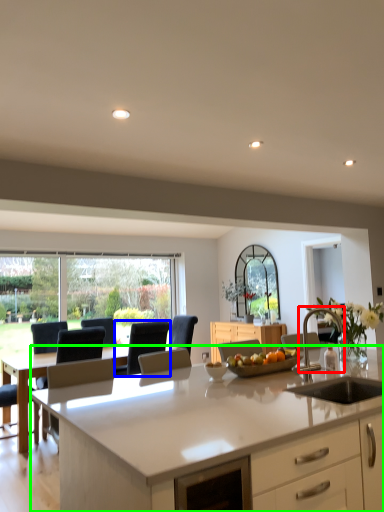
Question: Which object is positioned farthest from armchair (highlighted by a red box)? Select from armchair (highlighted by a blue box) and countertop (highlighted by a green box).

Choices:
 (A) armchair
 (B) countertop

Answer: (A)